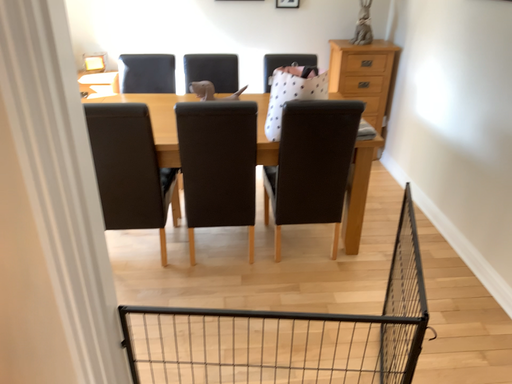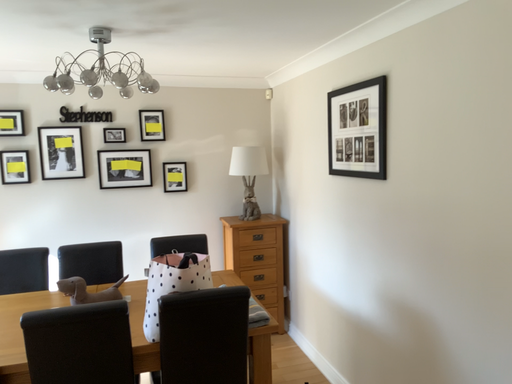
Question: Which way did the camera rotate in the video?

Choices:
 (A) rotated upward
 (B) rotated downward

Answer: (A)